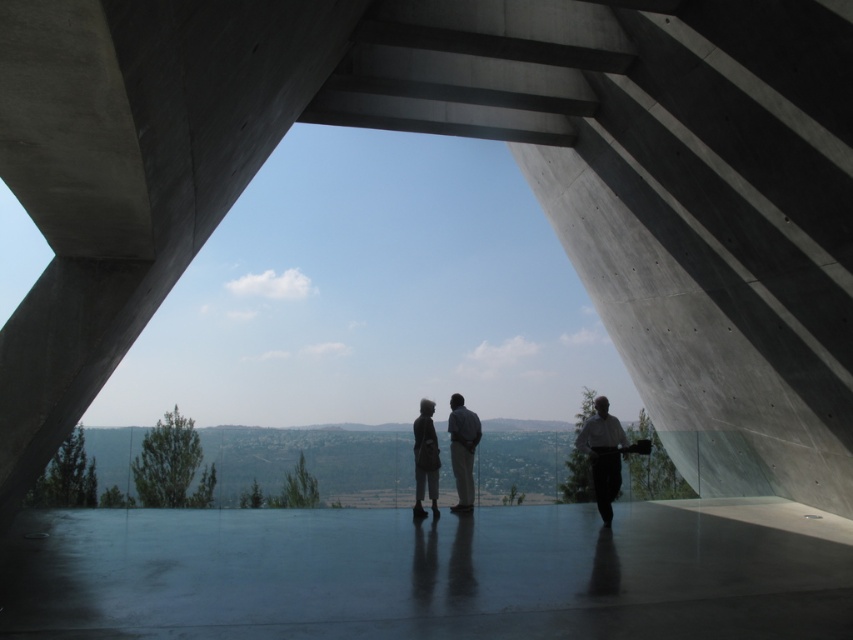
Does white shirt at right have a lesser width compared to dark gray suit at center?

Incorrect, white shirt at right's width is not less than dark gray suit at center's.

Is white shirt at right shorter than dark gray suit at center?

In fact, white shirt at right may be taller than dark gray suit at center.

This screenshot has width=853, height=640. What are the coordinates of `white shirt at right` in the screenshot? It's located at (602, 454).

Find the location of `white shirt at right`. white shirt at right is located at coordinates (602, 454).

Who is positioned more to the right, white shirt at right or dark gray fabric bag at center?

From the viewer's perspective, white shirt at right appears more on the right side.

Between point (608, 474) and point (434, 451), which one is positioned in front?

Point (608, 474)

This screenshot has height=640, width=853. Identify the location of white shirt at right. (602, 454).

In the scene shown: Is smooth concrete floor at center positioned behind white shirt at right?

No, smooth concrete floor at center is closer to the viewer.

Who is more forward, (9,577) or (592,429)?

Point (9,577) is more forward.

At what (x,y) coordinates should I click in order to perform the action: click on smooth concrete floor at center. Please return your answer as a coordinate pair (x, y). This screenshot has width=853, height=640. Looking at the image, I should click on (422, 576).